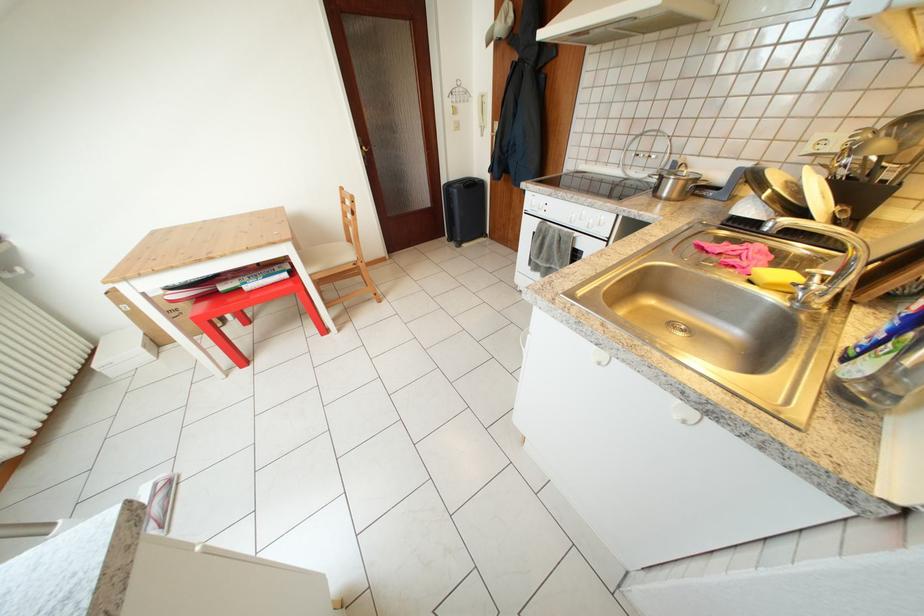
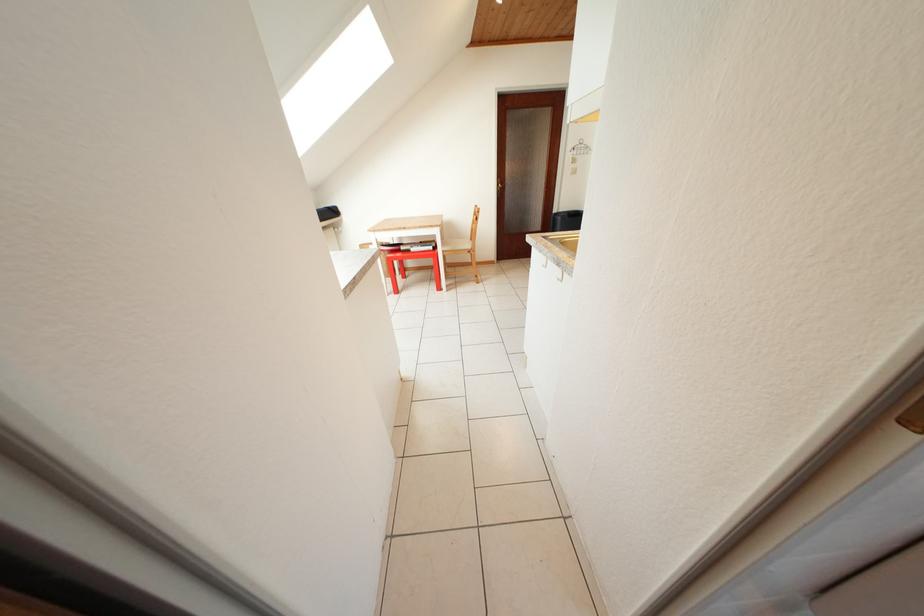
Question: The first image is from the beginning of the video and the second image is from the end. How did the camera likely rotate when shooting the video?

Choices:
 (A) Left
 (B) Right
 (C) Up
 (D) Down

Answer: (A)